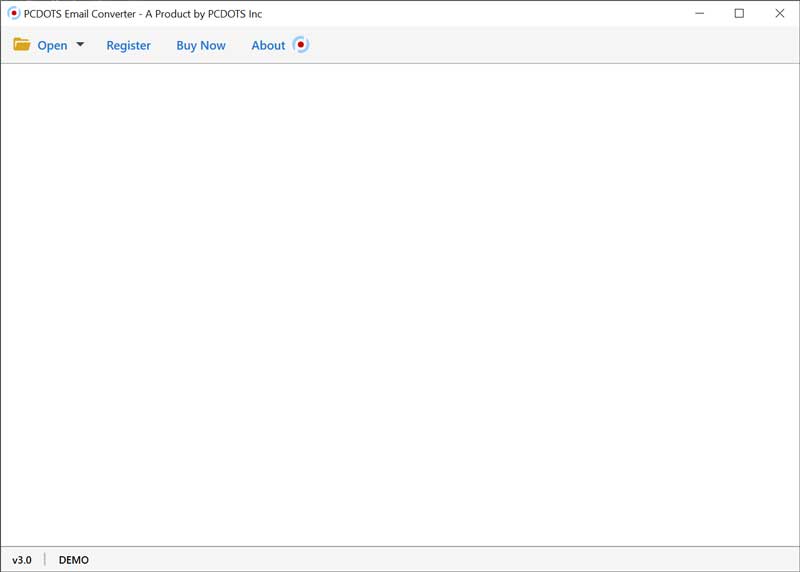
In order to click on open file folder in this screenshot , I will do (x=46, y=45).